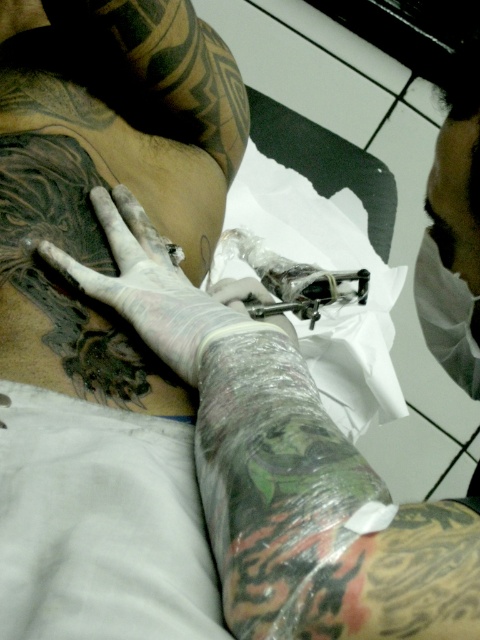
Question: Among these objects, which one is farthest from the camera?

Choices:
 (A) white latex glove at center
 (B) clear plastic glove at center
 (C) white latex glove at upper center

Answer: (B)

Question: Is white latex glove at upper center bigger than clear plastic glove at center?

Choices:
 (A) no
 (B) yes

Answer: (B)

Question: Which point is closer to the camera?

Choices:
 (A) (272, 592)
 (B) (105, 227)

Answer: (A)

Question: From the image, what is the correct spatial relationship of white latex glove at center in relation to clear plastic glove at center?

Choices:
 (A) below
 (B) above

Answer: (B)

Question: Which point is farther from the camera taking this photo?

Choices:
 (A) (228, 285)
 (B) (160, 248)

Answer: (A)

Question: Can you confirm if white latex glove at center is bigger than clear plastic glove at center?

Choices:
 (A) yes
 (B) no

Answer: (A)